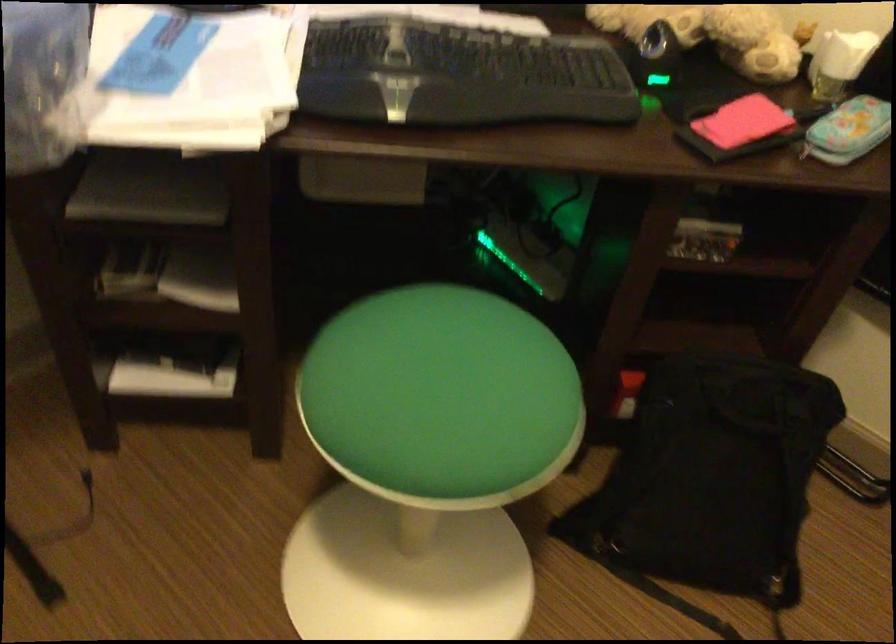
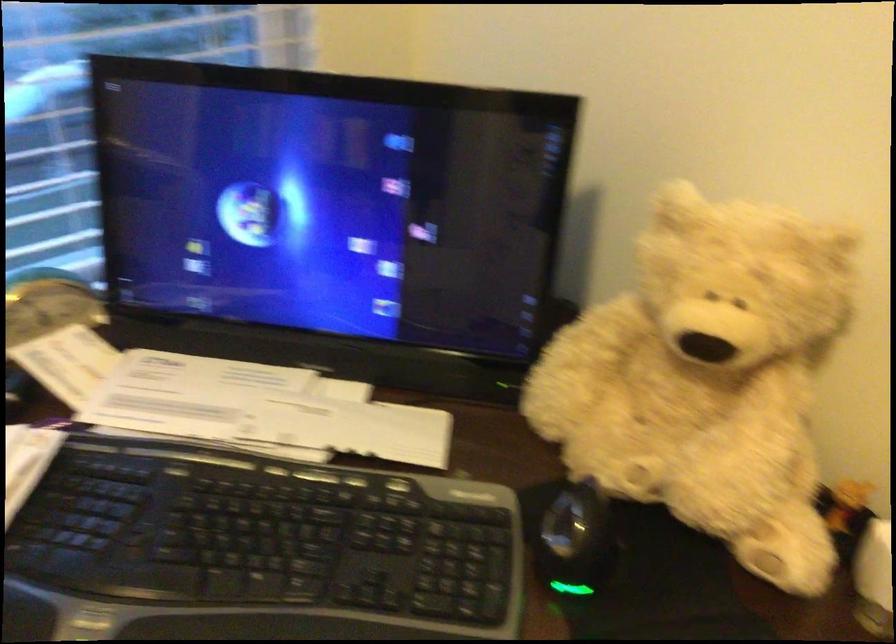
Question: The images are taken continuously from a first-person perspective. In which direction is your viewpoint rotating?

Choices:
 (A) Left
 (B) Right
 (C) Up
 (D) Down

Answer: (A)